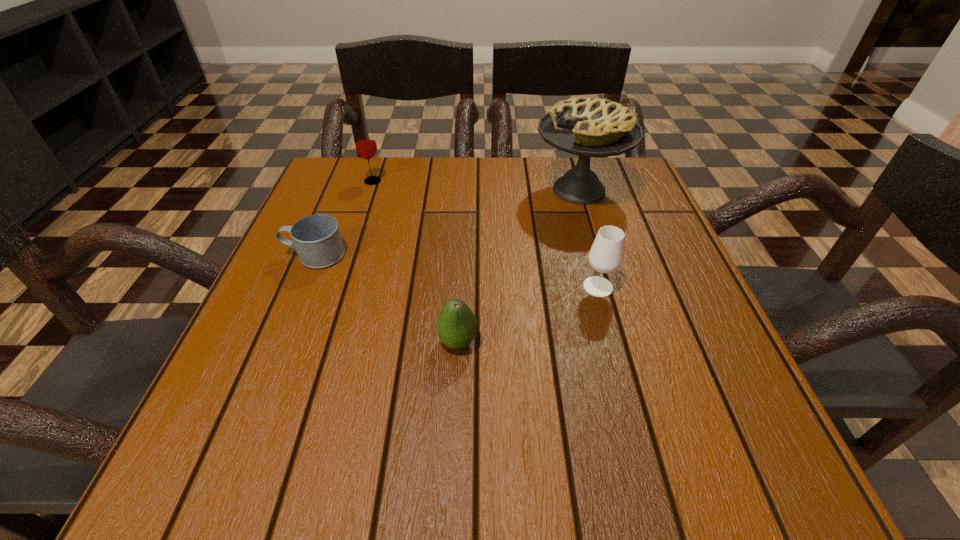
Where is `vacant space that's between the left glass and the pie`? This screenshot has height=540, width=960. vacant space that's between the left glass and the pie is located at coordinates (476, 185).

Where is `free area in between the nearer glass and the nearest object`? This screenshot has width=960, height=540. free area in between the nearer glass and the nearest object is located at coordinates (528, 314).

You are a GUI agent. You are given a task and a screenshot of the screen. Output one action in this format:
    pyautogui.click(x=<x>, y=<y>)
    Task: Click on the vacant area that lies between the third object from left to right and the farther glass
    This screenshot has height=540, width=960.
    Given the screenshot: What is the action you would take?
    pyautogui.click(x=416, y=262)

The height and width of the screenshot is (540, 960). What are the coordinates of `free space between the mug and the farther glass` in the screenshot? It's located at (344, 218).

The width and height of the screenshot is (960, 540). Find the location of `vacant space that is in between the nearest object and the shortest object`. vacant space that is in between the nearest object and the shortest object is located at coordinates (387, 299).

Locate an element on the screen. empty location between the farther glass and the third nearest object is located at coordinates (344, 218).

You are a GUI agent. You are given a task and a screenshot of the screen. Output one action in this format:
    pyautogui.click(x=<x>, y=<y>)
    Task: Click on the free space between the left glass and the pie
    Image resolution: width=960 pixels, height=540 pixels.
    Given the screenshot: What is the action you would take?
    pyautogui.click(x=476, y=185)

Image resolution: width=960 pixels, height=540 pixels. What are the coordinates of `empty location between the pie and the second nearest object` in the screenshot? It's located at (588, 238).

Select which object is the third closest to the farther glass. Please provide its 2D coordinates. Your answer should be formatted as a tuple, i.e. [(x, y)], where the tuple contains the x and y coordinates of a point satisfying the conditions above.

[(457, 325)]

Locate an element on the screen. object that is the fourth closest to the left glass is located at coordinates (606, 254).